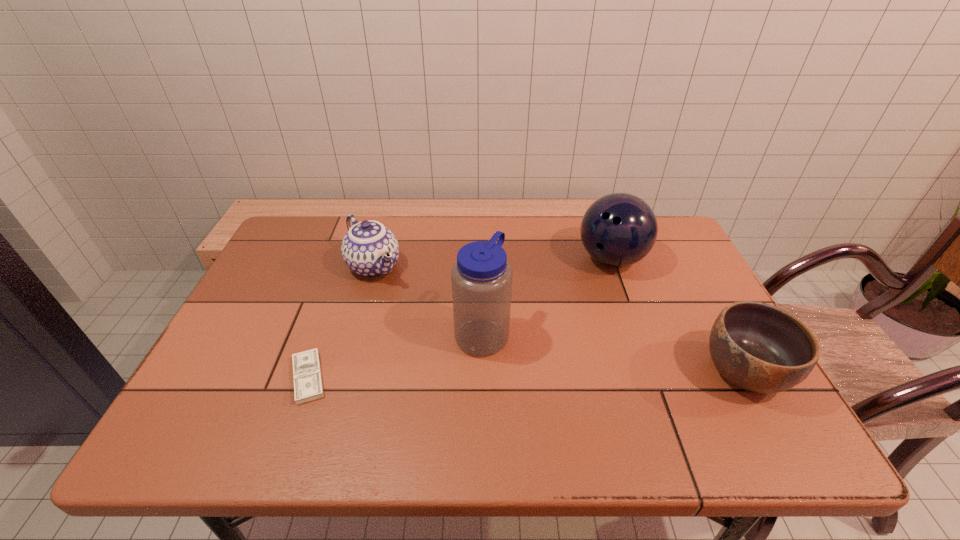
What are the coordinates of `vacant spot on the desktop that is between the shortest object and the bowl and is positioned from the spout of the chinaware` in the screenshot? It's located at (465, 375).

You are a GUI agent. You are given a task and a screenshot of the screen. Output one action in this format:
    pyautogui.click(x=<x>, y=<y>)
    Task: Click on the free space on the desktop that is between the money and the rightmost object and is positioned on the surface of the second object from right to left near the finger holes
    Image resolution: width=960 pixels, height=540 pixels.
    Given the screenshot: What is the action you would take?
    pyautogui.click(x=574, y=374)

The height and width of the screenshot is (540, 960). What are the coordinates of `free spot on the desktop that is between the shortest object and the rightmost object and is positioned with a carrying loop on the side of the water bottle` in the screenshot? It's located at (565, 374).